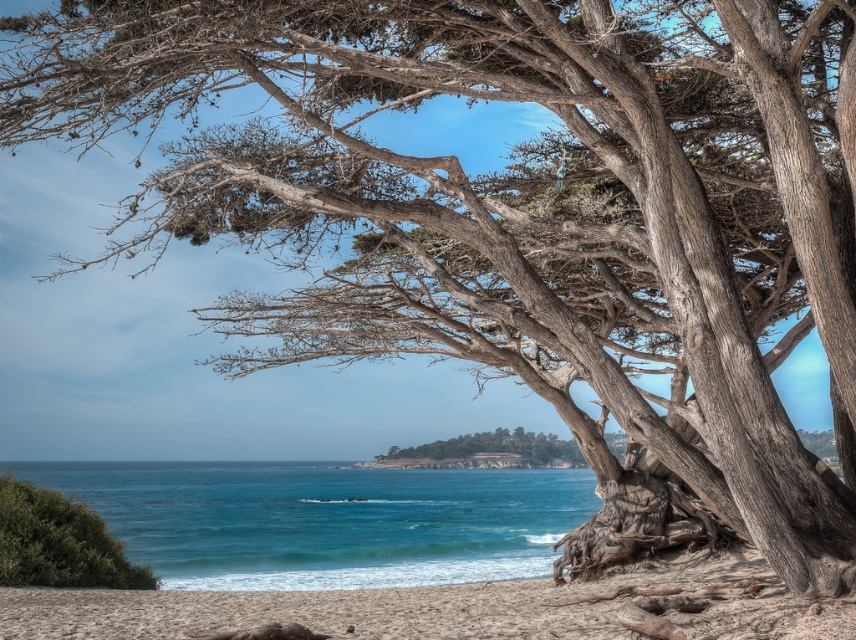
Is blue water at lower center positioned before sandy beach at lower center?

No, it is behind sandy beach at lower center.

Image resolution: width=856 pixels, height=640 pixels. Describe the element at coordinates (325, 520) in the screenshot. I see `blue water at lower center` at that location.

At what (x,y) coordinates should I click in order to perform the action: click on blue water at lower center. Please return your answer as a coordinate pair (x, y). This screenshot has height=640, width=856. Looking at the image, I should click on coord(325,520).

Based on the photo, does sandy beach at lower center have a lesser width compared to green leafy bush at lower left?

No.

Can you confirm if sandy beach at lower center is shorter than green leafy bush at lower left?

No, sandy beach at lower center is not shorter than green leafy bush at lower left.

Does point (54, 595) lie behind point (10, 518)?

No, it is not.

You are a GUI agent. You are given a task and a screenshot of the screen. Output one action in this format:
    pyautogui.click(x=<x>, y=<y>)
    Task: Click on the sandy beach at lower center
    This screenshot has height=640, width=856.
    Given the screenshot: What is the action you would take?
    pyautogui.click(x=450, y=608)

Between blue water at lower center and green leafy bush at lower left, which one is positioned higher?

green leafy bush at lower left is above.

You are a GUI agent. You are given a task and a screenshot of the screen. Output one action in this format:
    pyautogui.click(x=<x>, y=<y>)
    Task: Click on the blue water at lower center
    
    Given the screenshot: What is the action you would take?
    pyautogui.click(x=325, y=520)